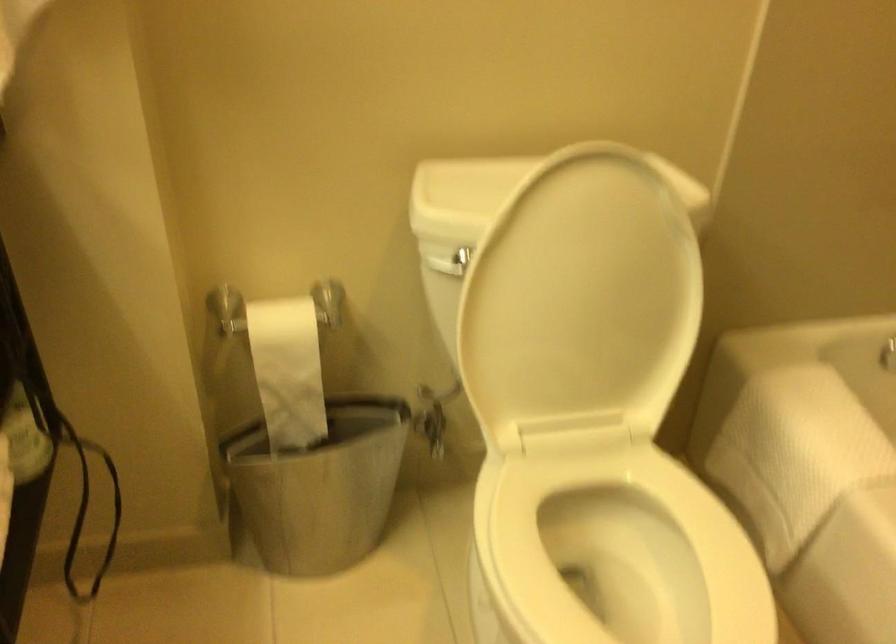
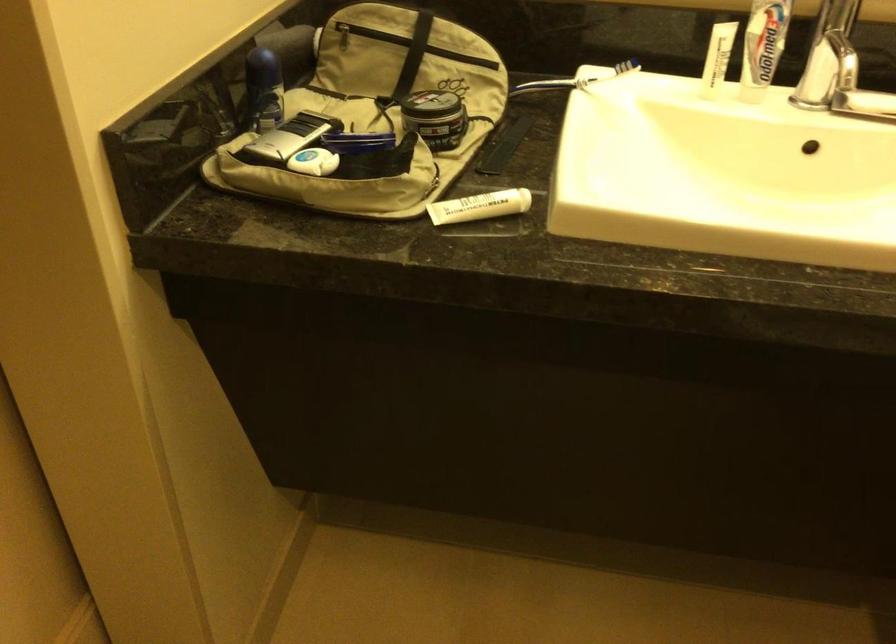
First-person continuous shooting, in which direction is the camera rotating?

The camera's rotation is toward left-down.